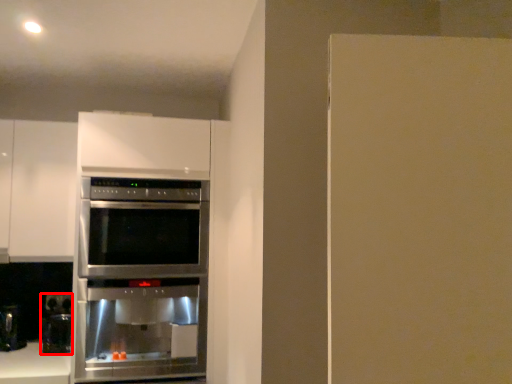
Question: In this image, where is coffee machine (annotated by the red box) located relative to oven?

Choices:
 (A) right
 (B) left

Answer: (B)